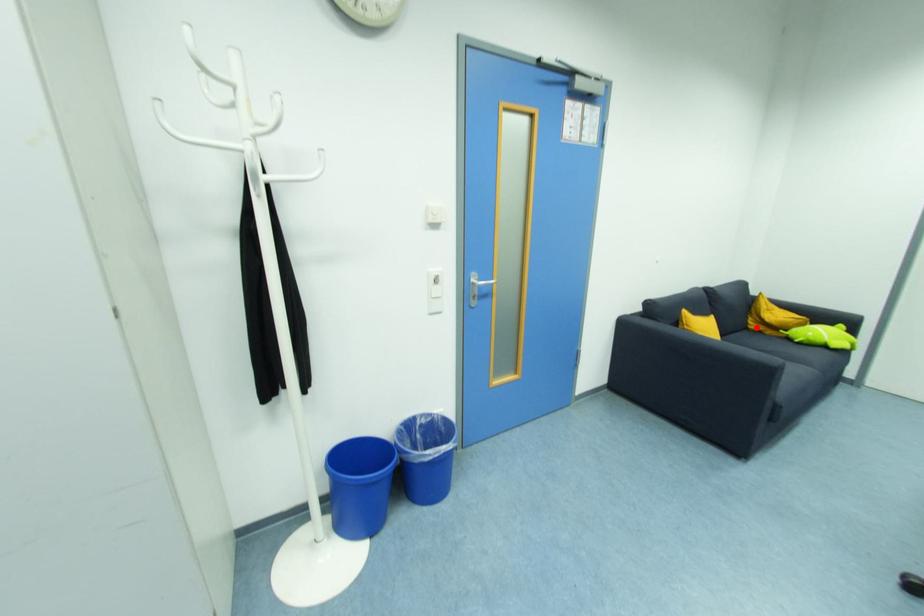
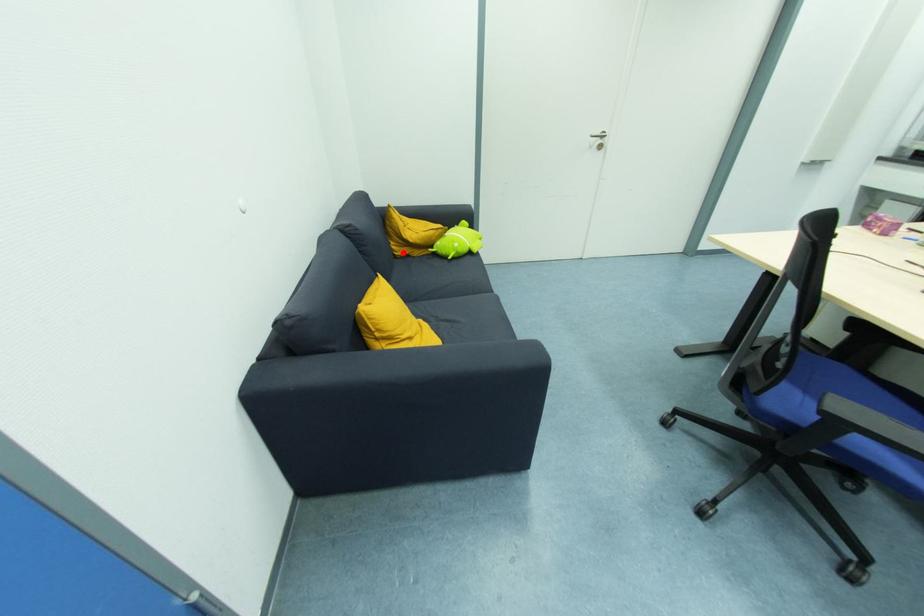
I am providing you with two images of the same scene from different viewpoints. A red point is marked on the first image and another point is marked on the second image. Do the highlighted points in image1 and image2 indicate the same real-world spot?

Yes